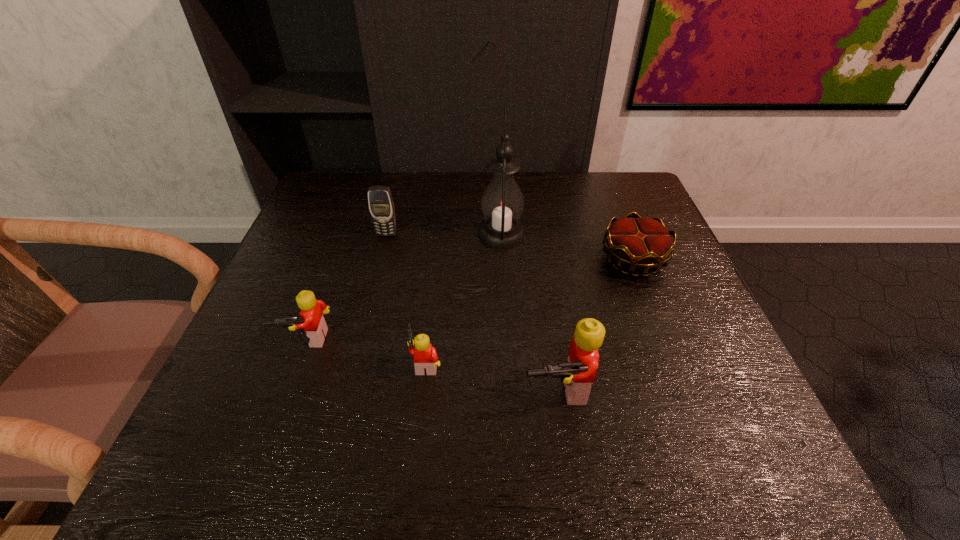
Find the location of a particular element. free area in between the second tallest object and the second Lego from right to left is located at coordinates (492, 376).

Identify the location of empty location between the tallest Lego and the tallest object. Image resolution: width=960 pixels, height=540 pixels. (529, 312).

Identify the location of free space between the oil lamp and the leftmost object. The image size is (960, 540). (404, 286).

Find the location of a particular element. This screenshot has height=540, width=960. empty space between the cellular telephone and the second tallest Lego is located at coordinates (348, 287).

Select which object appears as the fifth closest to the rightmost Lego. Please provide its 2D coordinates. Your answer should be formatted as a tuple, i.e. [(x, y)], where the tuple contains the x and y coordinates of a point satisfying the conditions above.

[(380, 201)]

Choose which object is the fourth nearest neighbor to the second object from left to right. Please provide its 2D coordinates. Your answer should be formatted as a tuple, i.e. [(x, y)], where the tuple contains the x and y coordinates of a point satisfying the conditions above.

[(577, 375)]

Find the location of a particular element. Lego object that ranks as the second closest to the tallest object is located at coordinates (577, 375).

Select which Lego appears as the closest to the tallest object. Please provide its 2D coordinates. Your answer should be formatted as a tuple, i.e. [(x, y)], where the tuple contains the x and y coordinates of a point satisfying the conditions above.

[(425, 356)]

At what (x,y) coordinates should I click in order to perform the action: click on vacant area in the image that satisfies the following two spatial constraints: 1. on the front face of the second object from left to right; 2. on the right side of the rightmost object. Please return your answer as a coordinate pair (x, y). Looking at the image, I should click on (380, 259).